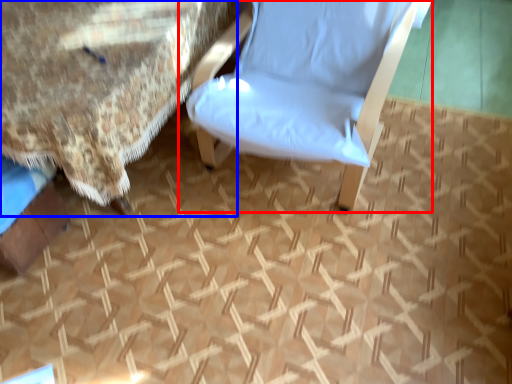
Question: Which point is closer to the camera, chair (highlighted by a red box) or bed (highlighted by a blue box)?

Choices:
 (A) chair
 (B) bed

Answer: (A)